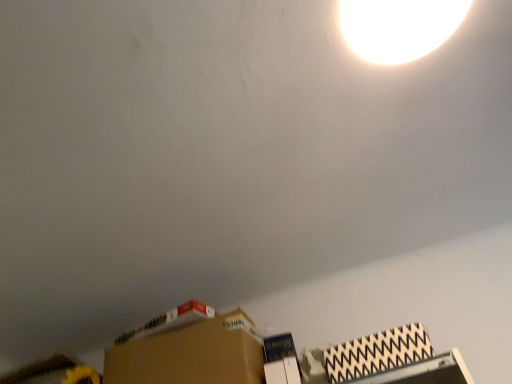
Question: Is white glossy lampshade at upper center further to the viewer compared to patterned cardboard box at lower right, the second cardboard box positioned from the left?

Choices:
 (A) no
 (B) yes

Answer: (A)

Question: Considering the relative positions of white glossy lampshade at upper center and patterned cardboard box at lower right, the 1th cardboard box positioned from the front, in the image provided, is white glossy lampshade at upper center to the right of patterned cardboard box at lower right, the 1th cardboard box positioned from the front, from the viewer's perspective?

Choices:
 (A) yes
 (B) no

Answer: (A)

Question: Is white glossy lampshade at upper center surrounding patterned cardboard box at lower right, the 1th cardboard box positioned from the front?

Choices:
 (A) yes
 (B) no

Answer: (B)

Question: Is white glossy lampshade at upper center positioned in front of patterned cardboard box at lower right, the 1th cardboard box from the right?

Choices:
 (A) yes
 (B) no

Answer: (A)

Question: Is white glossy lampshade at upper center touching patterned cardboard box at lower right, the second cardboard box positioned from the left?

Choices:
 (A) yes
 (B) no

Answer: (B)

Question: Considering their positions, is brown cardboard box at lower center, marked as the second cardboard box in a right-to-left arrangement, located in front of or behind patterned cardboard box at lower right, positioned as the 2th cardboard box in back-to-front order?

Choices:
 (A) behind
 (B) front

Answer: (A)

Question: Is brown cardboard box at lower center, marked as the second cardboard box in a right-to-left arrangement, inside the boundaries of patterned cardboard box at lower right, the 1th cardboard box from the right, or outside?

Choices:
 (A) outside
 (B) inside

Answer: (A)

Question: From their relative heights in the image, would you say brown cardboard box at lower center, arranged as the second cardboard box when viewed from the front, is taller or shorter than patterned cardboard box at lower right, the 1th cardboard box positioned from the front?

Choices:
 (A) short
 (B) tall

Answer: (B)

Question: Is brown cardboard box at lower center, marked as the second cardboard box in a right-to-left arrangement, wider or thinner than patterned cardboard box at lower right, the 1th cardboard box positioned from the front?

Choices:
 (A) thin
 (B) wide

Answer: (B)

Question: Considering the relative positions of white glossy lampshade at upper center and brown cardboard box at lower center, marked as the second cardboard box in a right-to-left arrangement, in the image provided, is white glossy lampshade at upper center to the left or to the right of brown cardboard box at lower center, marked as the second cardboard box in a right-to-left arrangement,?

Choices:
 (A) right
 (B) left

Answer: (A)

Question: From a real-world perspective, is white glossy lampshade at upper center physically located above or below brown cardboard box at lower center, the 1th cardboard box in the left-to-right sequence?

Choices:
 (A) above
 (B) below

Answer: (A)

Question: From the image's perspective, is white glossy lampshade at upper center located above or below brown cardboard box at lower center, placed as the first cardboard box when sorted from back to front?

Choices:
 (A) below
 (B) above

Answer: (B)

Question: Considering the positions of white glossy lampshade at upper center and brown cardboard box at lower center, arranged as the second cardboard box when viewed from the front, in the image, is white glossy lampshade at upper center wider or thinner than brown cardboard box at lower center, arranged as the second cardboard box when viewed from the front,?

Choices:
 (A) wide
 (B) thin

Answer: (B)

Question: Visually, is patterned cardboard box at lower right, positioned as the 2th cardboard box in back-to-front order, positioned to the left or to the right of white glossy lampshade at upper center?

Choices:
 (A) right
 (B) left

Answer: (B)

Question: Looking at their shapes, would you say patterned cardboard box at lower right, the 1th cardboard box from the right, is wider or thinner than white glossy lampshade at upper center?

Choices:
 (A) wide
 (B) thin

Answer: (B)